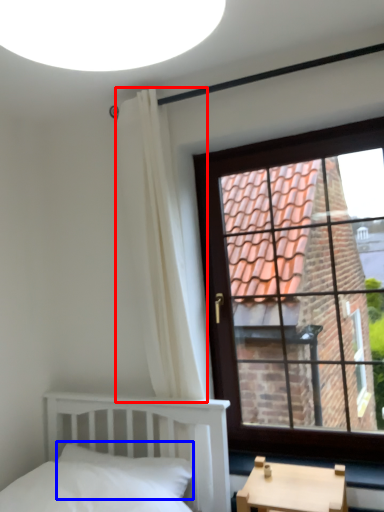
Question: Which object appears closest to the camera in this image, curtain (highlighted by a red box) or pillow (highlighted by a blue box)?

Choices:
 (A) curtain
 (B) pillow

Answer: (B)